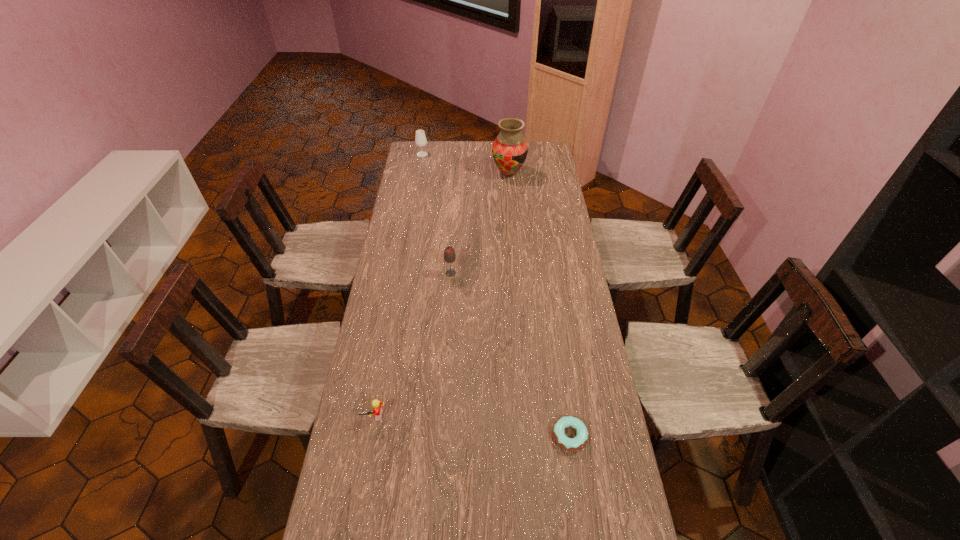
The width and height of the screenshot is (960, 540). I want to click on free space located 0.270m on the front of the right glass drink container, so 447,333.

Where is `blank area located in front of the second shortest object with the accessory visible`? This screenshot has width=960, height=540. blank area located in front of the second shortest object with the accessory visible is located at coordinates (358, 508).

The image size is (960, 540). Find the location of `free region located on the front of the doughnut`. free region located on the front of the doughnut is located at coordinates (576, 483).

What are the coordinates of `vase present at the far edge` in the screenshot? It's located at (510, 149).

Find the location of a particular element. The height and width of the screenshot is (540, 960). glass present at the far edge is located at coordinates (420, 139).

This screenshot has width=960, height=540. I want to click on glass located in the left edge section of the desktop, so click(420, 139).

Find the location of a particular element. This screenshot has width=960, height=540. Lego that is at the left edge is located at coordinates (377, 409).

This screenshot has width=960, height=540. Identify the location of vase at the right edge. (510, 149).

You are a GUI agent. You are given a task and a screenshot of the screen. Output one action in this format:
    pyautogui.click(x=<x>, y=<y>)
    Task: Click on the doughnut positioned at the right edge
    This screenshot has width=960, height=540.
    Given the screenshot: What is the action you would take?
    pyautogui.click(x=571, y=444)

Locate an element on the screen. object that is at the far left corner is located at coordinates (420, 139).